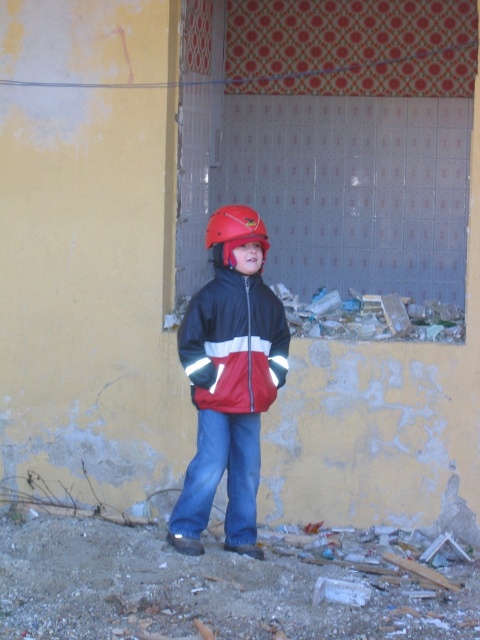
Is point (263, 243) closer to viewer compared to point (262, 230)?

No, it is not.

Where is `matte black jacket at center`? The width and height of the screenshot is (480, 640). matte black jacket at center is located at coordinates (229, 380).

Is matte black jacket at center in front of red matte jacket at center?

No.

Does point (228, 484) come in front of point (219, 307)?

That is False.

Where is `matte black jacket at center`? matte black jacket at center is located at coordinates (229, 380).

Where is `matte black jacket at center`? The height and width of the screenshot is (640, 480). matte black jacket at center is located at coordinates (229, 380).

Does point (355, 314) lie in front of point (260, 221)?

No, it is behind (260, 221).

Is broken glass shards at lower center to the right of matte red helmet at center from the viewer's perspective?

Correct, you'll find broken glass shards at lower center to the right of matte red helmet at center.

Which is in front, point (288, 320) or point (230, 237)?

Point (230, 237) is in front.

At what (x,y) coordinates should I click in order to perform the action: click on broken glass shards at lower center. Please return your answer as a coordinate pair (x, y). The height and width of the screenshot is (640, 480). Looking at the image, I should click on (370, 316).